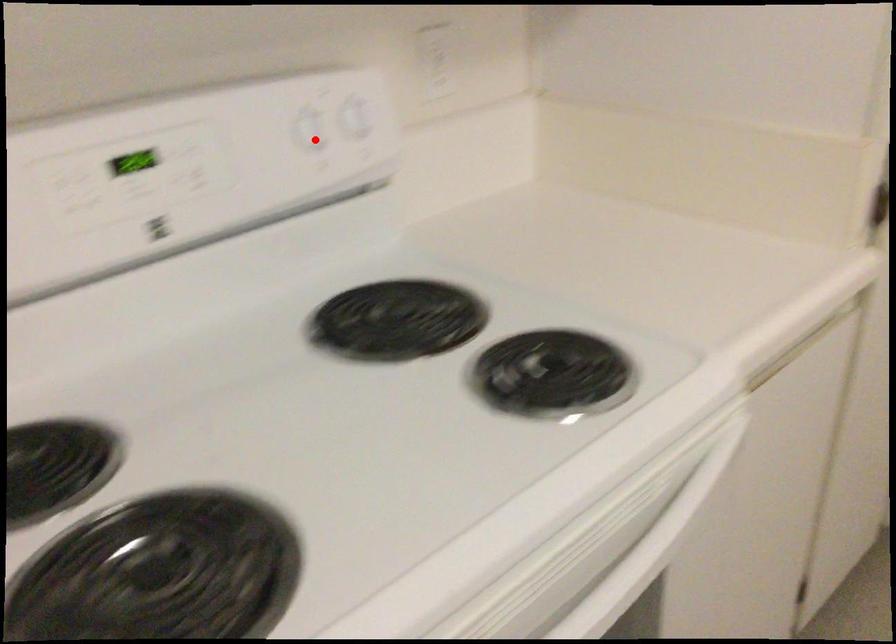
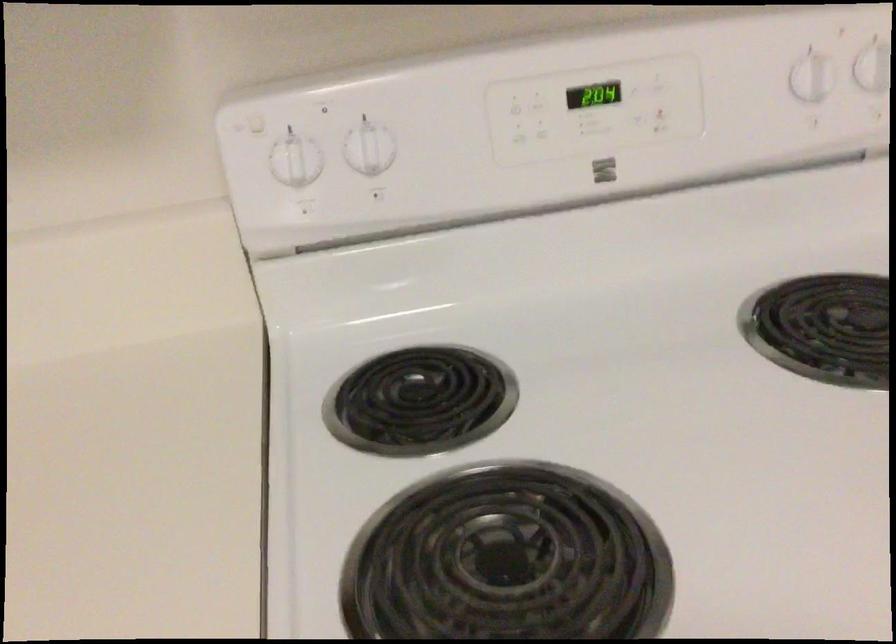
Question: I am providing you with two images of the same scene from different viewpoints. A red point is shown in image1. For the corresponding object point in image2, is it positioned nearer or farther from the camera?

Choices:
 (A) Nearer
 (B) Farther

Answer: (A)